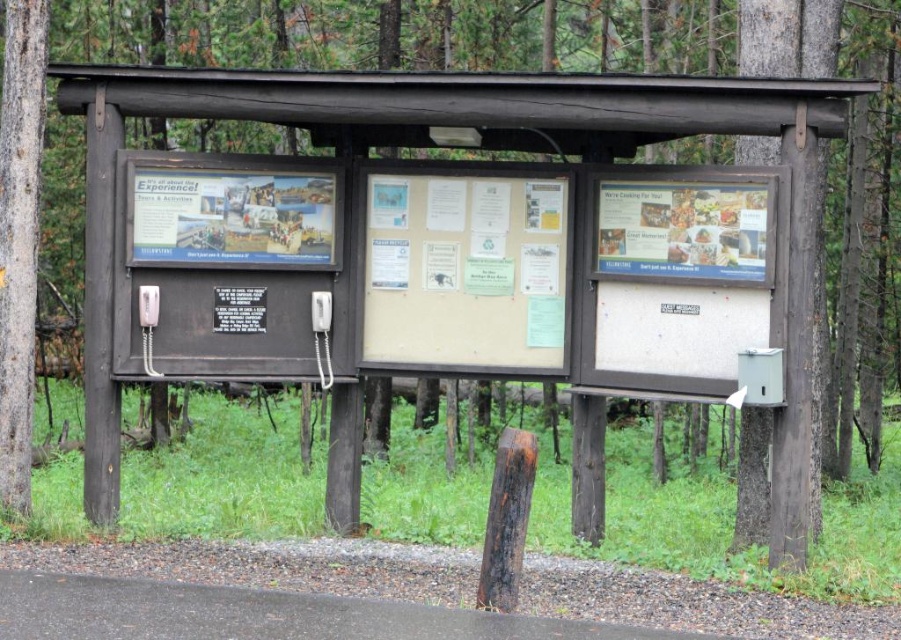
Who is positioned more to the right, rusty wood post at lower center or white plastic payphone at center?

rusty wood post at lower center is more to the right.

I want to click on rusty wood post at lower center, so click(x=506, y=520).

Which is in front, point (631, 355) or point (34, 316)?

Point (34, 316)

Between wooden bus stop at center and smooth gray bark at left, which one appears on the right side from the viewer's perspective?

wooden bus stop at center

Which is behind, point (355, 428) or point (6, 445)?

Positioned behind is point (355, 428).

You are a GUI agent. You are given a task and a screenshot of the screen. Output one action in this format:
    pyautogui.click(x=<x>, y=<y>)
    Task: Click on the wooden bus stop at center
    This screenshot has height=640, width=901.
    Given the screenshot: What is the action you would take?
    pyautogui.click(x=471, y=248)

Which of these two, beige paperboard at center or metallic gray phone box at lower right, stands taller?

Standing taller between the two is beige paperboard at center.

Does beige paperboard at center have a larger size compared to metallic gray phone box at lower right?

Correct, beige paperboard at center is larger in size than metallic gray phone box at lower right.

Who is more distant from viewer, (x=398, y=243) or (x=756, y=397)?

Positioned behind is point (x=398, y=243).

The width and height of the screenshot is (901, 640). I want to click on beige paperboard at center, so click(465, 269).